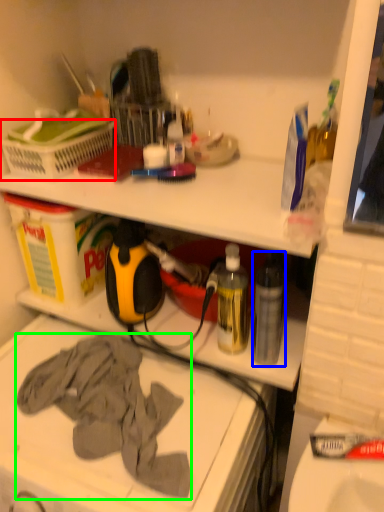
Question: Which is nearer to the laundry basket (highlighted by a red box)? bottle (highlighted by a blue box) or clothing (highlighted by a green box).

Choices:
 (A) bottle
 (B) clothing

Answer: (B)